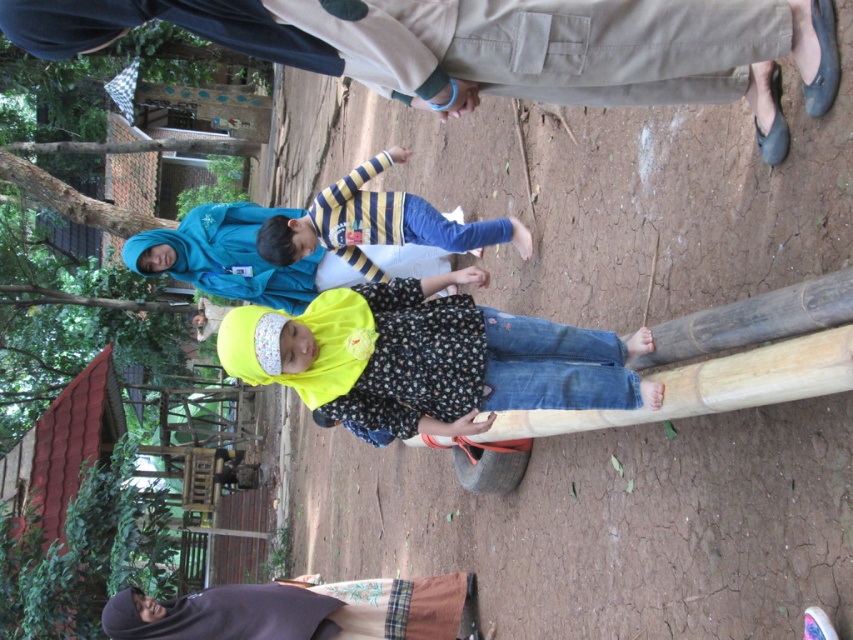
Can you confirm if floral fabric dress at center is bigger than dark purple fabric at lower left?

Yes.

Is floral fabric dress at center below dark purple fabric at lower left?

Actually, floral fabric dress at center is above dark purple fabric at lower left.

Find the location of a particular element. The height and width of the screenshot is (640, 853). floral fabric dress at center is located at coordinates (426, 356).

Can you confirm if dark purple fabric at lower left is thinner than striped fabric shirt at center?

In fact, dark purple fabric at lower left might be wider than striped fabric shirt at center.

Can you confirm if dark purple fabric at lower left is taller than striped fabric shirt at center?

No.

This screenshot has height=640, width=853. Describe the element at coordinates (297, 611) in the screenshot. I see `dark purple fabric at lower left` at that location.

The image size is (853, 640). What are the coordinates of `dark purple fabric at lower left` in the screenshot? It's located at (297, 611).

Between point (407, 435) and point (403, 227), which one is positioned behind?

Point (403, 227)

Between floral fabric dress at center and striped fabric shirt at center, which one has less height?

With less height is floral fabric dress at center.

Does point (489, 349) lie in front of point (408, 204)?

That is True.

You are a GUI agent. You are given a task and a screenshot of the screen. Output one action in this format:
    pyautogui.click(x=<x>, y=<y>)
    Task: Click on the floral fabric dress at center
    The width and height of the screenshot is (853, 640).
    Given the screenshot: What is the action you would take?
    pos(426,356)